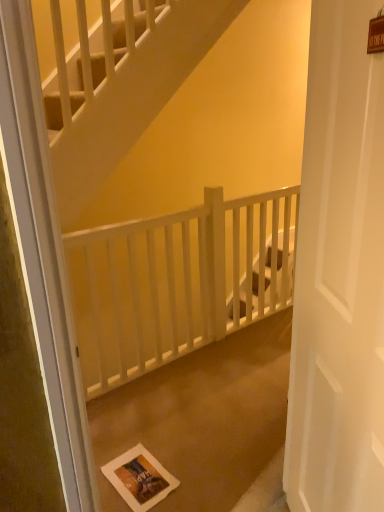
Question: From the image's perspective, is white wooden balustrade at center below white paper postcard at lower center?

Choices:
 (A) no
 (B) yes

Answer: (A)

Question: Considering the relative sizes of white wooden balustrade at center and white paper postcard at lower center in the image provided, is white wooden balustrade at center wider than white paper postcard at lower center?

Choices:
 (A) no
 (B) yes

Answer: (A)

Question: Is white wooden balustrade at center taller than white paper postcard at lower center?

Choices:
 (A) no
 (B) yes

Answer: (B)

Question: Is white wooden balustrade at center smaller than white paper postcard at lower center?

Choices:
 (A) no
 (B) yes

Answer: (A)

Question: Is white wooden balustrade at center looking in the opposite direction of white paper postcard at lower center?

Choices:
 (A) no
 (B) yes

Answer: (A)

Question: Can you confirm if white wooden balustrade at center is positioned to the left of white paper postcard at lower center?

Choices:
 (A) no
 (B) yes

Answer: (A)

Question: Considering the relative sizes of white paper bag at center and white matte door at center in the image provided, is white paper bag at center bigger than white matte door at center?

Choices:
 (A) no
 (B) yes

Answer: (B)

Question: Is white paper bag at center located outside white matte door at center?

Choices:
 (A) no
 (B) yes

Answer: (B)

Question: Does white paper bag at center have a smaller size compared to white matte door at center?

Choices:
 (A) no
 (B) yes

Answer: (A)

Question: From a real-world perspective, is white paper bag at center physically above white matte door at center?

Choices:
 (A) yes
 (B) no

Answer: (B)

Question: From the image's perspective, is white paper bag at center located above white matte door at center?

Choices:
 (A) no
 (B) yes

Answer: (A)

Question: Considering the relative sizes of white paper bag at center and white matte door at center in the image provided, is white paper bag at center shorter than white matte door at center?

Choices:
 (A) yes
 (B) no

Answer: (A)

Question: Is white matte door at center outside of white wooden balustrade at center?

Choices:
 (A) no
 (B) yes

Answer: (B)